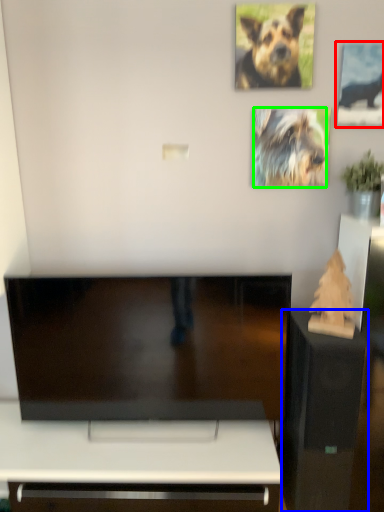
Question: Which object is positioned farthest from picture frame (highlighted by a red box)? Select from furniture (highlighted by a blue box) and dog (highlighted by a green box).

Choices:
 (A) furniture
 (B) dog

Answer: (A)